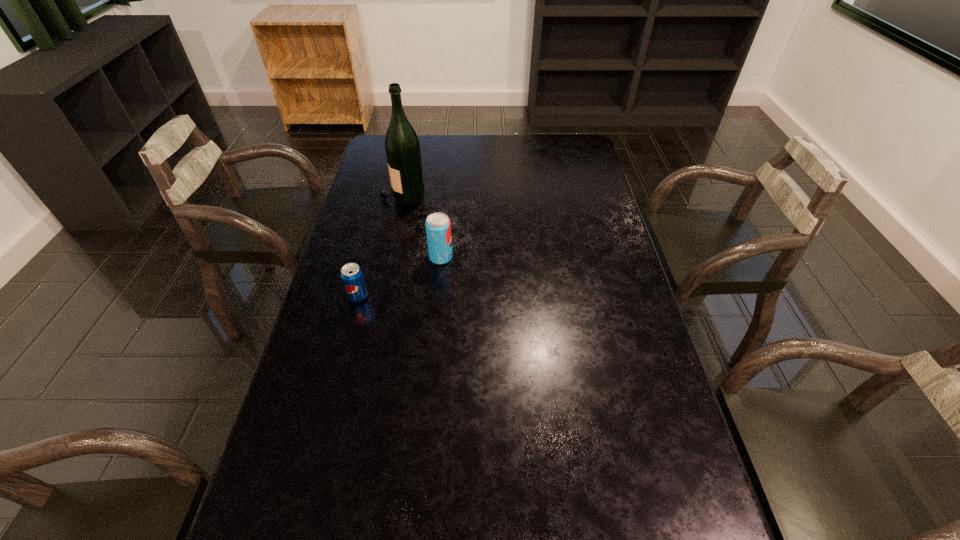
This screenshot has height=540, width=960. I want to click on pop soda positioned at the left edge, so click(x=351, y=274).

The image size is (960, 540). Identify the location of free region at the far edge of the desktop. (543, 156).

Where is `vacant region at the left edge of the desktop`? Image resolution: width=960 pixels, height=540 pixels. vacant region at the left edge of the desktop is located at coordinates (357, 198).

This screenshot has height=540, width=960. In the image, there is a desktop. Find the location of `vacant space at the right edge`. vacant space at the right edge is located at coordinates (591, 301).

Image resolution: width=960 pixels, height=540 pixels. Find the location of `vacant space in between the nearest object and the second farthest object`. vacant space in between the nearest object and the second farthest object is located at coordinates 399,276.

Identify the location of empty space between the second shortest object and the wine bottle. (421, 226).

Identify the location of free point between the tallest object and the taller pop soda. (421, 226).

Identify the location of vacant region between the second tallest object and the tallest object. (421, 226).

I want to click on free space that is in between the rightmost object and the wine bottle, so click(421, 226).

The height and width of the screenshot is (540, 960). Identify the location of object that ranks as the closest to the second nearest object. (351, 274).